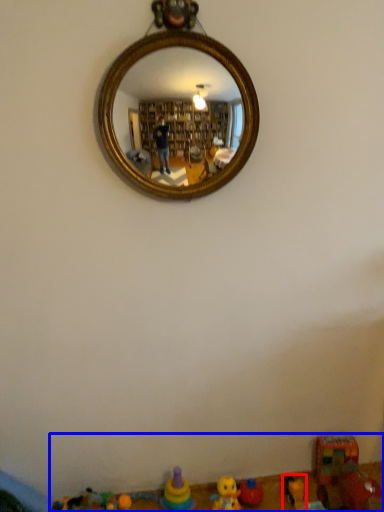
Question: Which of the following is the closest to the observer, toy (highlighted by a red box) or toy (highlighted by a blue box)?

Choices:
 (A) toy
 (B) toy

Answer: (B)